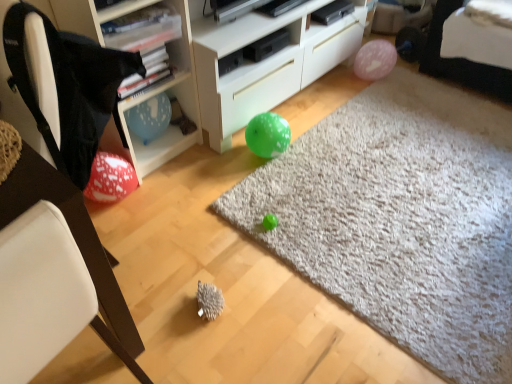
Question: Is black fabric bean bag chair at left further to the viewer compared to white plastic shelf at upper left?

Choices:
 (A) no
 (B) yes

Answer: (A)

Question: From the image's perspective, is black fabric bean bag chair at left below white plastic shelf at upper left?

Choices:
 (A) no
 (B) yes

Answer: (B)

Question: Are black fabric bean bag chair at left and white plastic shelf at upper left located far from each other?

Choices:
 (A) yes
 (B) no

Answer: (B)

Question: Is white plastic shelf at upper left completely or partially inside black fabric bean bag chair at left?

Choices:
 (A) yes
 (B) no

Answer: (B)

Question: Is black fabric bean bag chair at left smaller than white plastic shelf at upper left?

Choices:
 (A) no
 (B) yes

Answer: (B)

Question: Is black fabric bean bag chair at left bigger or smaller than blue paper balloon at upper left?

Choices:
 (A) small
 (B) big

Answer: (B)

Question: Considering the positions of black fabric bean bag chair at left and blue paper balloon at upper left in the image, is black fabric bean bag chair at left wider or thinner than blue paper balloon at upper left?

Choices:
 (A) thin
 (B) wide

Answer: (B)

Question: From a real-world perspective, is black fabric bean bag chair at left above or below blue paper balloon at upper left?

Choices:
 (A) below
 (B) above

Answer: (B)

Question: Visually, is black fabric bean bag chair at left positioned to the left or to the right of blue paper balloon at upper left?

Choices:
 (A) right
 (B) left

Answer: (B)

Question: Looking at the image, does black fabric bean bag chair at left seem bigger or smaller compared to white matte cabinet at center?

Choices:
 (A) big
 (B) small

Answer: (B)

Question: From the image's perspective, relative to white matte cabinet at center, is black fabric bean bag chair at left above or below?

Choices:
 (A) below
 (B) above

Answer: (A)

Question: Would you say black fabric bean bag chair at left is to the left or to the right of white matte cabinet at center in the picture?

Choices:
 (A) right
 (B) left

Answer: (B)

Question: From a real-world perspective, relative to white matte cabinet at center, is black fabric bean bag chair at left vertically above or below?

Choices:
 (A) above
 (B) below

Answer: (A)

Question: In terms of width, does blue paper balloon at upper left look wider or thinner when compared to white plastic shelf at upper left?

Choices:
 (A) thin
 (B) wide

Answer: (A)

Question: Is point (170, 145) positioned closer to the camera than point (198, 134)?

Choices:
 (A) closer
 (B) farther

Answer: (A)